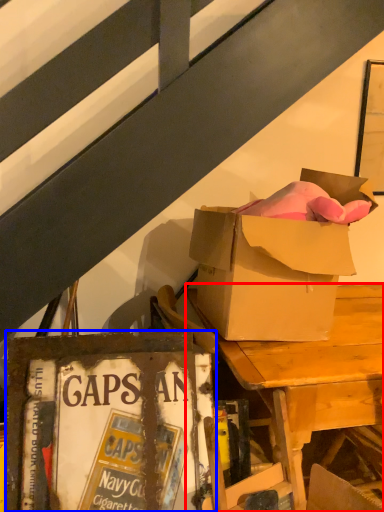
Question: Among these objects, which one is farthest to the camera, desk (highlighted by a red box) or paperback book (highlighted by a blue box)?

Choices:
 (A) desk
 (B) paperback book

Answer: (A)